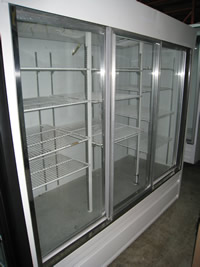
At what (x,y) coordinates should I click in order to perform the action: click on dark ceiling. Please return your answer as a coordinate pair (x, y). Looking at the image, I should click on (190, 9).